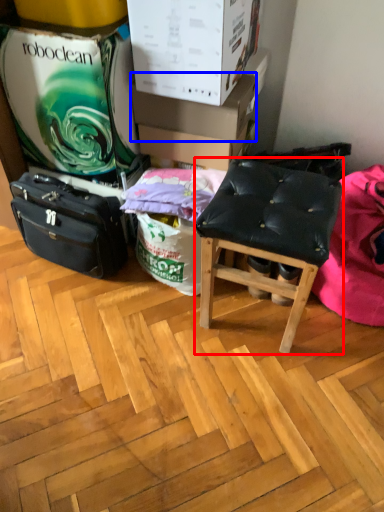
Question: Which object appears farthest to the camera in this image, stool (highlighted by a red box) or cardboard box (highlighted by a blue box)?

Choices:
 (A) stool
 (B) cardboard box

Answer: (B)